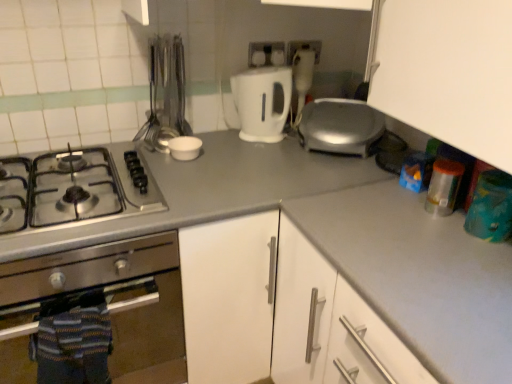
Question: Considering the relative sizes of white plastic electric outlet at upper center, the 1th electric outlet positioned from the right, and white plastic electric outlet at upper center, positioned as the second electric outlet in right-to-left order, in the image provided, is white plastic electric outlet at upper center, the 1th electric outlet positioned from the right, wider than white plastic electric outlet at upper center, positioned as the second electric outlet in right-to-left order,?

Choices:
 (A) yes
 (B) no

Answer: (A)

Question: Does white plastic electric outlet at upper center, the 1th electric outlet positioned from the right, have a smaller size compared to white plastic electric outlet at upper center, positioned as the second electric outlet in right-to-left order?

Choices:
 (A) no
 (B) yes

Answer: (A)

Question: From the image's perspective, is white plastic electric outlet at upper center, which is counted as the second electric outlet, starting from the left, below white plastic electric outlet at upper center, positioned as the second electric outlet in right-to-left order?

Choices:
 (A) no
 (B) yes

Answer: (A)

Question: From a real-world perspective, is white plastic electric outlet at upper center, which is counted as the second electric outlet, starting from the left, located higher than white plastic electric outlet at upper center, the 1th electric outlet from the left?

Choices:
 (A) no
 (B) yes

Answer: (A)

Question: From a real-world perspective, is white plastic electric outlet at upper center, which is counted as the second electric outlet, starting from the left, positioned under white plastic electric outlet at upper center, the 1th electric outlet from the left, based on gravity?

Choices:
 (A) no
 (B) yes

Answer: (B)

Question: Considering the relative positions of white matte counter top at center and gray matte countertop at center in the image provided, is white matte counter top at center to the left or to the right of gray matte countertop at center?

Choices:
 (A) right
 (B) left

Answer: (A)

Question: Looking at the image, does white matte counter top at center seem bigger or smaller compared to gray matte countertop at center?

Choices:
 (A) small
 (B) big

Answer: (A)

Question: Is white matte counter top at center spatially inside gray matte countertop at center, or outside of it?

Choices:
 (A) inside
 (B) outside

Answer: (B)

Question: Considering the positions of point coord(459,364) and point coord(217,173), is point coord(459,364) closer or farther from the camera than point coord(217,173)?

Choices:
 (A) farther
 (B) closer

Answer: (B)

Question: From the image's perspective, relative to white matte bowl at center, is white matte counter top at center above or below?

Choices:
 (A) below
 (B) above

Answer: (A)

Question: Is white matte counter top at center spatially inside white matte bowl at center, or outside of it?

Choices:
 (A) inside
 (B) outside

Answer: (B)

Question: From a real-world perspective, relative to white matte bowl at center, is white matte counter top at center vertically above or below?

Choices:
 (A) above
 (B) below

Answer: (B)

Question: Considering the positions of white matte counter top at center and white matte bowl at center in the image, is white matte counter top at center bigger or smaller than white matte bowl at center?

Choices:
 (A) big
 (B) small

Answer: (A)

Question: From a real-world perspective, is stainless steel oven at left, marked as the first kitchen appliance in a left-to-right arrangement, physically located above or below white plastic electric outlet at upper center, positioned as the second electric outlet in right-to-left order?

Choices:
 (A) below
 (B) above

Answer: (A)

Question: From their relative heights in the image, would you say stainless steel oven at left, which is the 2th kitchen appliance from top to bottom, is taller or shorter than white plastic electric outlet at upper center, the 1th electric outlet from the left?

Choices:
 (A) tall
 (B) short

Answer: (A)